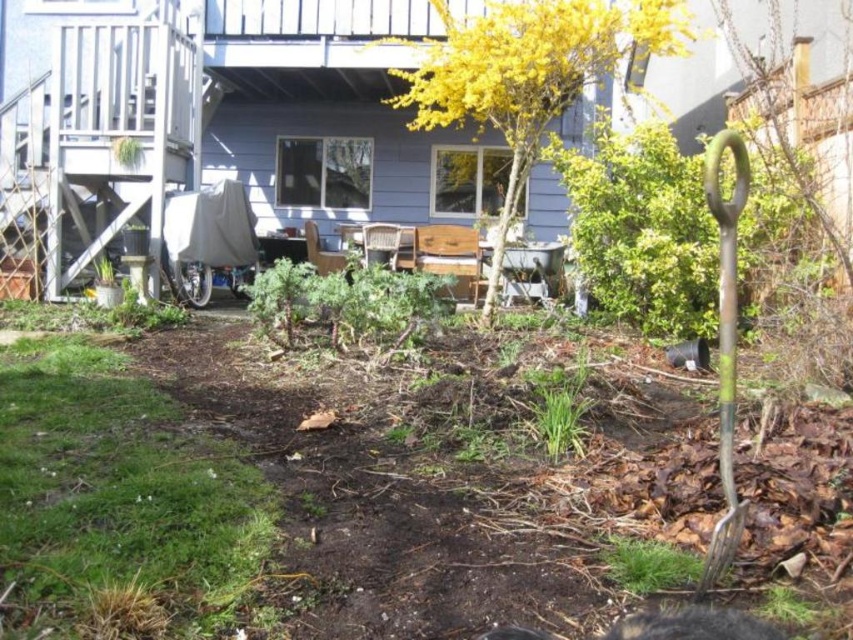
You are planning to plant a new flower in the backyard. You need to know which object is larger to decide where to place it. Which is bigger, the yellow leafy plant at upper center or the rusty metal shovel at right?

The yellow leafy plant at upper center is bigger than the rusty metal shovel at right, so you should consider placing the flower where there is enough space for the larger plant.

You are a gardener who wants to water the yellow leafy plant at upper center and the rusty metal shovel at right. Which object should you reach for first if you want to water the closest one first?

The yellow leafy plant at upper center is closer to you than the rusty metal shovel at right, so you should water the yellow leafy plant at upper center first.

What are the coordinates of the yellow leafy plant at upper center?

The yellow leafy plant at upper center is located at coordinates point (527, 74).